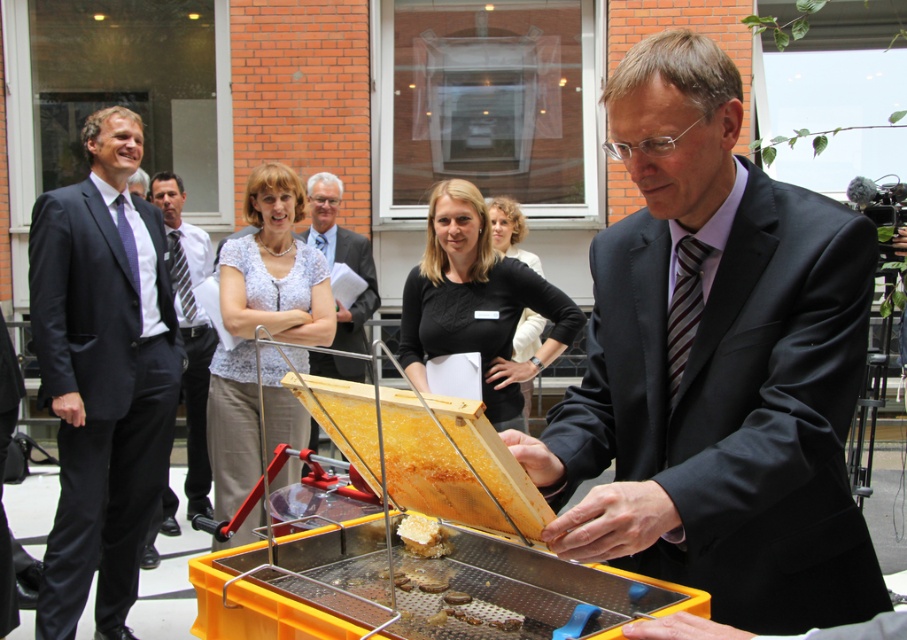
Question: Which object is positioned closest to the dark blue suit at left?

Choices:
 (A) white lace blouse at center
 (B) golden honeycomb at center
 (C) dark gray suit at center

Answer: (A)

Question: Which point is farther from the camera taking this photo?

Choices:
 (A) (462, 330)
 (B) (520, 237)
 (C) (456, 602)

Answer: (B)

Question: Considering the real-world distances, which object is closest to the golden honeycomb at center?

Choices:
 (A) black fabric shirt at center
 (B) black matte shirt at center
 (C) yellow honeycomb at center

Answer: (C)

Question: Does white lace blouse at center have a smaller size compared to black fabric shirt at center?

Choices:
 (A) yes
 (B) no

Answer: (B)

Question: Considering the relative positions of black matte shirt at center and dark gray suit at center in the image provided, where is black matte shirt at center located with respect to dark gray suit at center?

Choices:
 (A) right
 (B) left

Answer: (A)

Question: In this image, where is black matte shirt at center located relative to dark gray suit at left?

Choices:
 (A) above
 (B) below

Answer: (A)